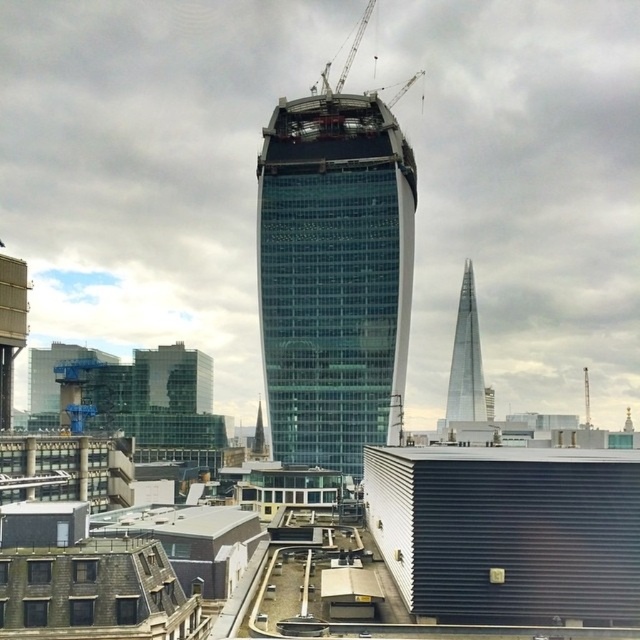
Who is positioned more to the right, transparent glass tower at right or metallic construction crane at upper center?

transparent glass tower at right

Is point (467, 378) behind point (360, 33)?

That is False.

Who is more forward, [461,310] or [321,84]?

Positioned in front is point [321,84].

Find the location of a particular element. Image resolution: width=640 pixels, height=640 pixels. transparent glass tower at right is located at coordinates (467, 360).

Based on the photo, is transparent glass skyscraper at center bigger than transparent glass tower at right?

Yes, transparent glass skyscraper at center is bigger than transparent glass tower at right.

Does transparent glass skyscraper at center have a greater width compared to transparent glass tower at right?

Yes, transparent glass skyscraper at center is wider than transparent glass tower at right.

Does point (328, 336) come farther from viewer compared to point (467, 266)?

No, (328, 336) is closer to viewer.

Where is `transparent glass skyscraper at center`? transparent glass skyscraper at center is located at coordinates (333, 276).

Is point (340, 429) positioned in front of point (340, 80)?

Yes, point (340, 429) is closer to viewer.

Between transparent glass skyscraper at center and metallic construction crane at upper center, which one appears on the left side from the viewer's perspective?

Positioned to the left is transparent glass skyscraper at center.

Is point (381, 310) positioned behind point (324, 83)?

No, it is not.

Where is `transparent glass skyscraper at center`? Image resolution: width=640 pixels, height=640 pixels. transparent glass skyscraper at center is located at coordinates (333, 276).